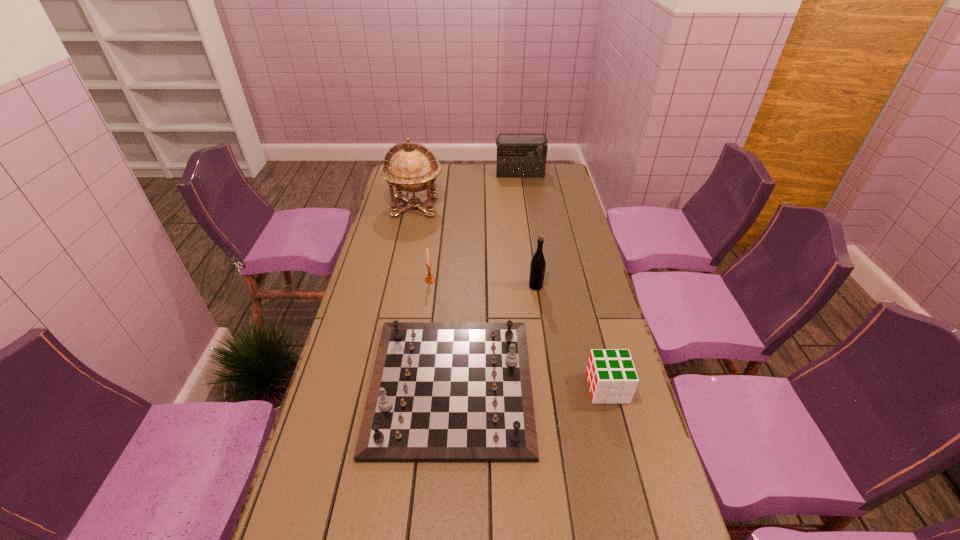
The width and height of the screenshot is (960, 540). Find the location of `vacant point at the far edge`. vacant point at the far edge is located at coordinates (473, 180).

Find the location of a particular element. vacant space at the left edge is located at coordinates (362, 498).

In the image, there is a desktop. Identify the location of vacant space at the right edge. Image resolution: width=960 pixels, height=540 pixels. (540, 188).

Where is `free space at the far right corner`? Image resolution: width=960 pixels, height=540 pixels. free space at the far right corner is located at coordinates (565, 183).

Where is `free space between the third shortest object and the farthest object`? Image resolution: width=960 pixels, height=540 pixels. free space between the third shortest object and the farthest object is located at coordinates (475, 227).

Locate an element on the screen. vacant area that lies between the chessboard and the second farthest object is located at coordinates (433, 296).

In order to click on vacant region between the chessboard and the globe in this screenshot , I will do `click(433, 296)`.

Where is `vacant space that is in between the candle_holder and the third tallest object`? vacant space that is in between the candle_holder and the third tallest object is located at coordinates (483, 283).

Where is `free spot between the cube and the second farthest object`? Image resolution: width=960 pixels, height=540 pixels. free spot between the cube and the second farthest object is located at coordinates (511, 297).

You are a GUI agent. You are given a task and a screenshot of the screen. Output one action in this format:
    pyautogui.click(x=<x>, y=<y>)
    Task: Click on the vacant space that is in between the candle_holder and the beer bottle
    This screenshot has width=960, height=540.
    Given the screenshot: What is the action you would take?
    pyautogui.click(x=483, y=283)